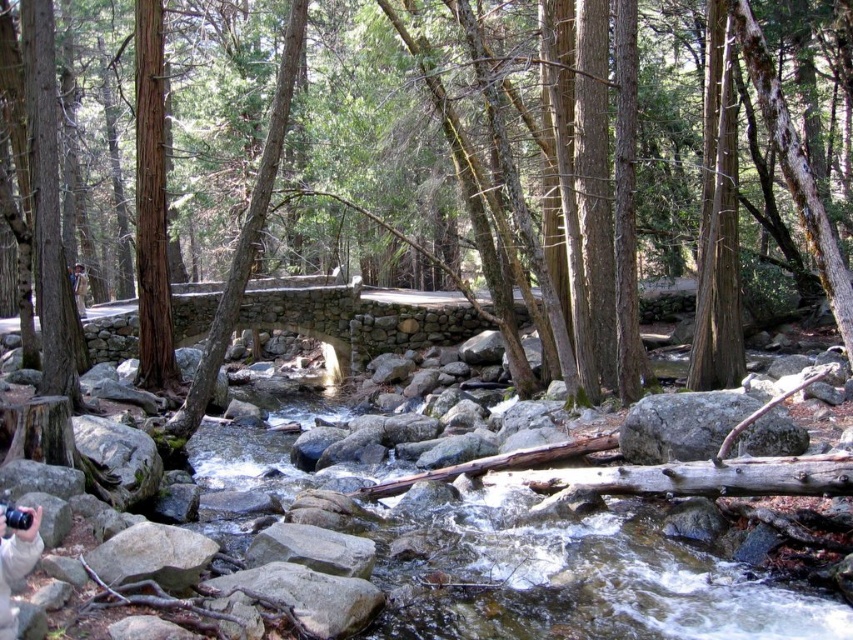
Is green mossy rocks at center wider than smooth gray rock at center?

Yes.

Which is behind, point (630, 360) or point (735, 445)?

Point (630, 360)

Is point (143, 166) positioned behind point (688, 422)?

Yes, it is behind point (688, 422).

Image resolution: width=853 pixels, height=640 pixels. I want to click on green mossy rocks at center, so click(793, 166).